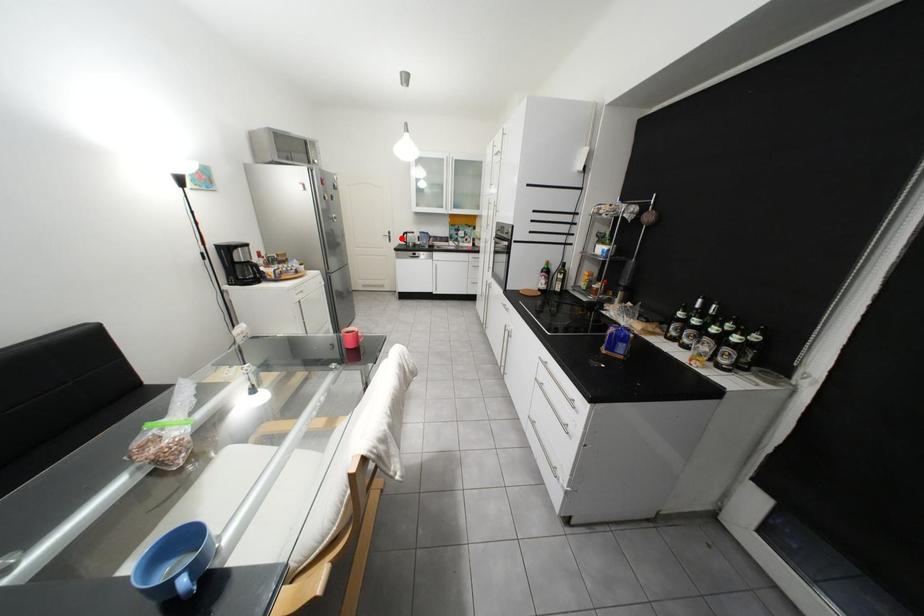
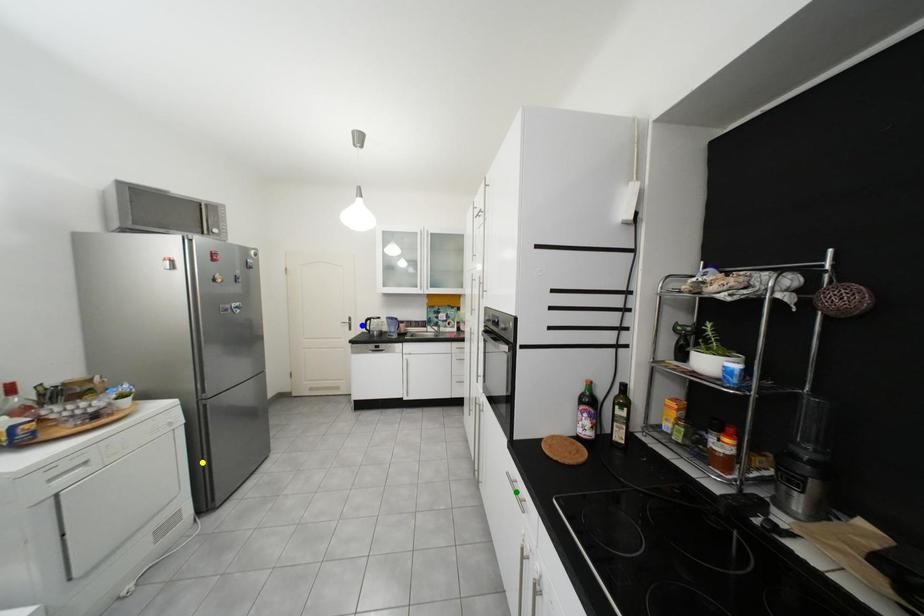
Question: I am providing you with two images of the same scene from different viewpoints. A red point is marked on the first image. You are given multiple points on the second image. In image 2, which mark is for the same physical point as the one in image 1?

Choices:
 (A) yellow point
 (B) green point
 (C) blue point

Answer: (C)